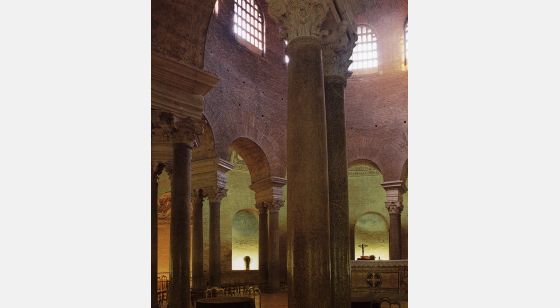
Find the location of a particular element. This screenshot has width=560, height=308. cornice is located at coordinates (196, 78).